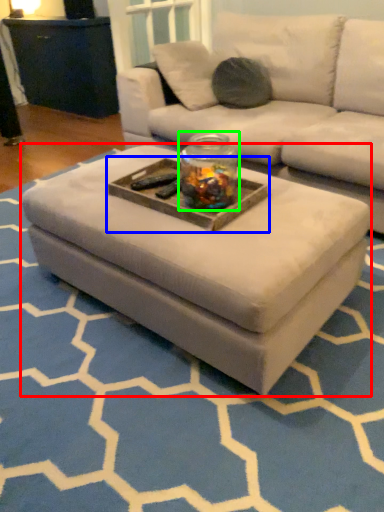
Question: Estimate the real-world distances between objects in this image. Which object is farther from coffee table (highlighted by a red box), tray (highlighted by a blue box) or glass jar (highlighted by a green box)?

Choices:
 (A) tray
 (B) glass jar

Answer: (B)